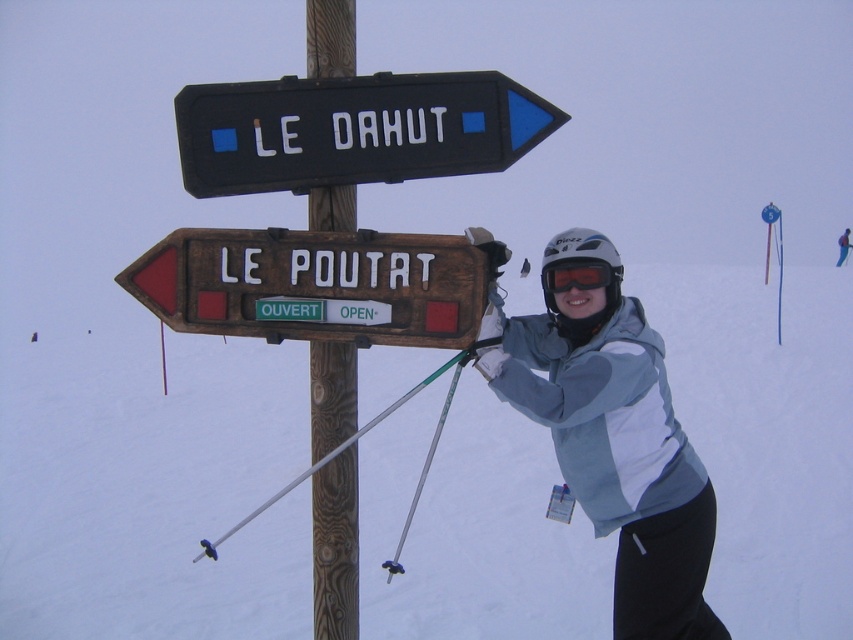
What do you see at coordinates (149, 486) in the screenshot? The width and height of the screenshot is (853, 640). I see `wooden signpost at center` at bounding box center [149, 486].

At what (x,y) coordinates should I click in order to perform the action: click on wooden signpost at center. Please return your answer as a coordinate pair (x, y). This screenshot has width=853, height=640. Looking at the image, I should click on (149, 486).

Is point (418, 131) farther from viewer compared to point (566, 278)?

No, (418, 131) is in front of (566, 278).

Can you confirm if black plastic sign at upper center is taller than orange reflective goggles at center?

Indeed, black plastic sign at upper center has a greater height compared to orange reflective goggles at center.

What do you see at coordinates (352, 129) in the screenshot? I see `black plastic sign at upper center` at bounding box center [352, 129].

I want to click on black plastic sign at upper center, so click(352, 129).

From the picture: Which is more to the right, wooden sign at center or orange reflective goggles at center?

Positioned to the right is orange reflective goggles at center.

Can you confirm if wooden sign at center is positioned above orange reflective goggles at center?

Incorrect, wooden sign at center is not positioned above orange reflective goggles at center.

Is point (136, 266) positioned after point (566, 273)?

No.

Find the location of a particular element. wooden sign at center is located at coordinates (317, 285).